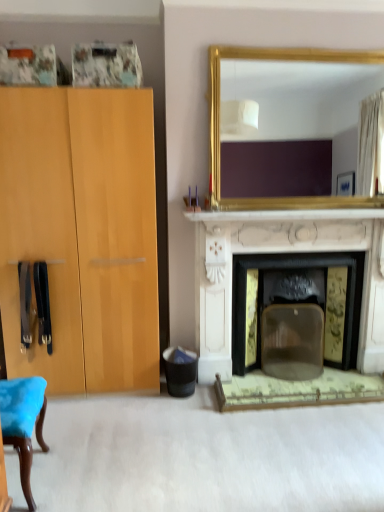
Question: Is gold-framed mirror at upper center in front of or behind white marble fireplace at center in the image?

Choices:
 (A) behind
 (B) front

Answer: (B)

Question: In the image, is gold-framed mirror at upper center on the left side or the right side of white marble fireplace at center?

Choices:
 (A) right
 (B) left

Answer: (A)

Question: Which is farther from the white marble fireplace at center?

Choices:
 (A) gold-framed mirror at upper center
 (B) black plastic trash bin at lower center

Answer: (B)

Question: Based on their relative distances, which object is nearer to the black plastic trash bin at lower center?

Choices:
 (A) gold-framed mirror at upper center
 (B) white marble fireplace at center

Answer: (B)